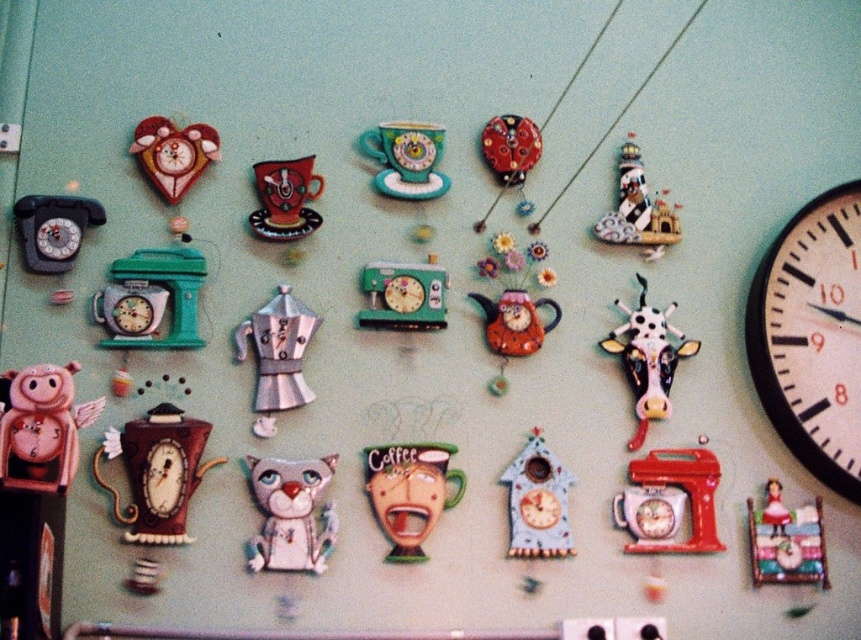
You are hanging a new clock on the teal wall and want to ensure it doesn not block the view of the existing clocks. The new clock is 10 cm tall. Which of the existing clocks, the white plastic clock at right or the matte green cup at center, has enough vertical space to accommodate the new clock without overlapping?

The white plastic clock at right has a greater height compared to the matte green cup at center, so it likely has more vertical space to accommodate the new clock without overlapping.

You are an interior designer evaluating the wall space for these clocks. The white plastic clock at right and the matte green cup at center are part of the collection. Based on their sizes, which one might require more careful placement to avoid overcrowding the wall?

The white plastic clock at right is bigger than the matte green cup at center, so it would require more careful placement to avoid overcrowding the wall.

You are an interior designer planning to hang a new clock that is 12 inches in diameter. You want to place it between the white plastic clock at right and the matte green cup at center. Is there enough space between them to fit your new clock?

The distance between the white plastic clock at right and the matte green cup at center is 26.34 inches. Since the new clock is 12 inches in diameter, there is sufficient space between them to accommodate it.